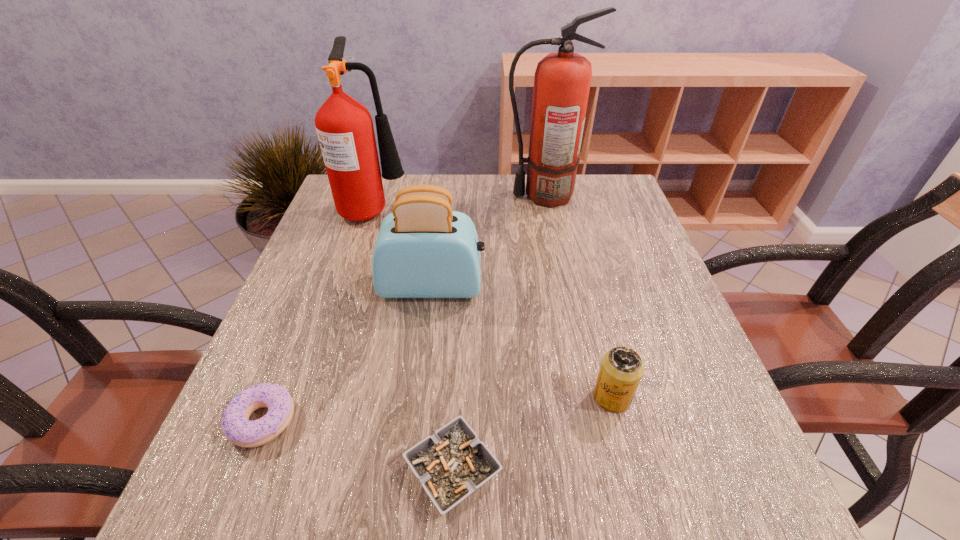
Locate an element on the screen. Image resolution: width=960 pixels, height=540 pixels. beer can that is at the right edge is located at coordinates (621, 370).

Locate an element on the screen. object present at the far left corner is located at coordinates (344, 126).

Where is `object that is positioned at the far right corner`? The width and height of the screenshot is (960, 540). object that is positioned at the far right corner is located at coordinates (562, 80).

At what (x,y) coordinates should I click in order to perform the action: click on vacant region at the near edge of the desktop. Please return your answer as a coordinate pair (x, y). This screenshot has height=540, width=960. Looking at the image, I should click on (618, 525).

Locate an element on the screen. This screenshot has width=960, height=540. vacant space at the right edge of the desktop is located at coordinates (737, 447).

The image size is (960, 540). I want to click on free space at the near left corner, so click(x=228, y=516).

In the image, there is a desktop. Identify the location of vacant space at the far right corner. The image size is (960, 540). (609, 181).

Where is `blank region between the right fire extinguisher and the toaster`? This screenshot has height=540, width=960. blank region between the right fire extinguisher and the toaster is located at coordinates (488, 241).

The width and height of the screenshot is (960, 540). I want to click on empty space between the shortest object and the left fire extinguisher, so click(414, 340).

Locate an element on the screen. The image size is (960, 540). free spot between the shortest object and the doughnut is located at coordinates (358, 446).